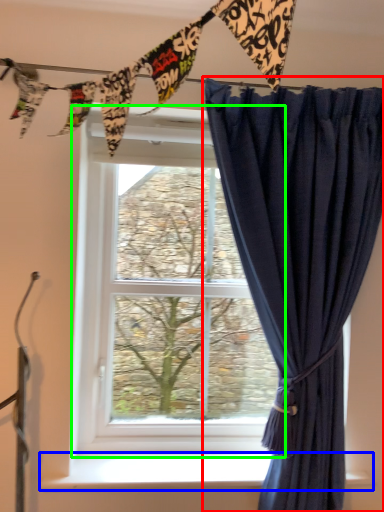
Question: Estimate the real-world distances between objects in this image. Which object is closer to curtain (highlighted by a red box), window sill (highlighted by a blue box) or window (highlighted by a green box)?

Choices:
 (A) window sill
 (B) window

Answer: (B)